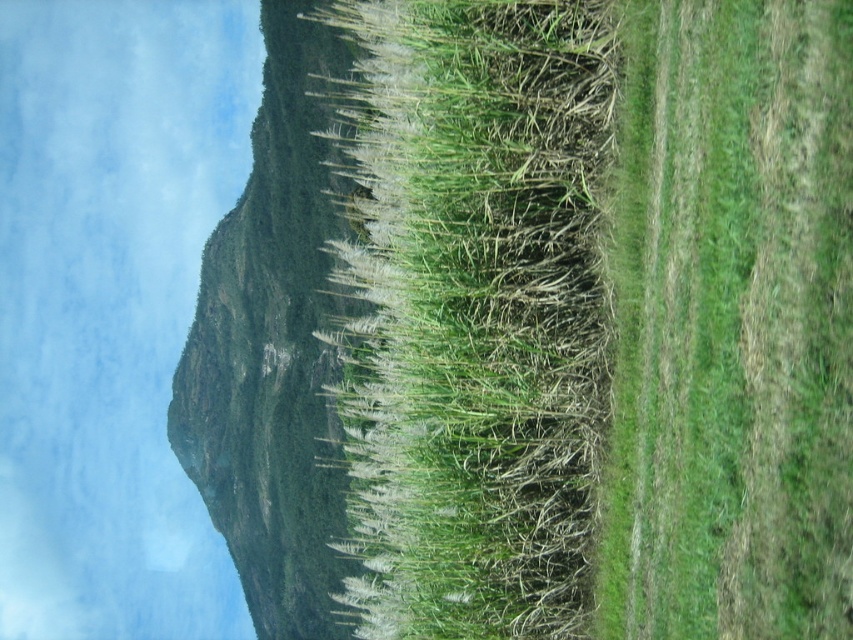
You are a GUI agent. You are given a task and a screenshot of the screen. Output one action in this format:
    pyautogui.click(x=<x>, y=<y>)
    Task: Click on the green grassy at center
    Image resolution: width=853 pixels, height=640 pixels.
    Given the screenshot: What is the action you would take?
    pyautogui.click(x=473, y=312)